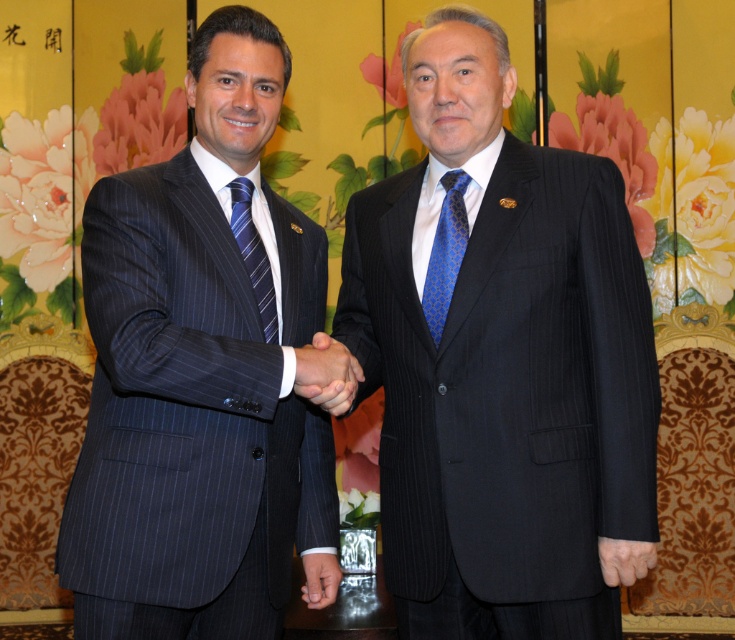
Which is below, dark blue pinstripe suit at center or smooth skin handshake at center?

Positioned lower is smooth skin handshake at center.

Can you confirm if dark blue pinstripe suit at center is taller than smooth skin handshake at center?

Correct, dark blue pinstripe suit at center is much taller as smooth skin handshake at center.

Between point (531, 216) and point (337, 349), which one is positioned behind?

The point (531, 216) is behind.

Where is `dark blue pinstripe suit at center`? dark blue pinstripe suit at center is located at coordinates (503, 365).

Does blue silk tie at center have a smaller size compared to blue striped tie at left?

Incorrect, blue silk tie at center is not smaller in size than blue striped tie at left.

Who is lower down, blue silk tie at center or blue striped tie at left?

blue striped tie at left

Who is more forward, [444,189] or [240,212]?

Point [240,212] is in front.

At what (x,y) coordinates should I click in order to perform the action: click on blue silk tie at center. Please return your answer as a coordinate pair (x, y). The width and height of the screenshot is (735, 640). Looking at the image, I should click on (445, 252).

Does blue pinstripe suit at left have a larger size compared to blue silk tie at center?

Yes.

Between blue pinstripe suit at left and blue silk tie at center, which one appears on the right side from the viewer's perspective?

blue silk tie at center

Measure the distance between point (240,499) and camera.

Point (240,499) is 5.81 feet away from camera.

Where is `blue pinstripe suit at left`? Image resolution: width=735 pixels, height=640 pixels. blue pinstripe suit at left is located at coordinates (200, 378).